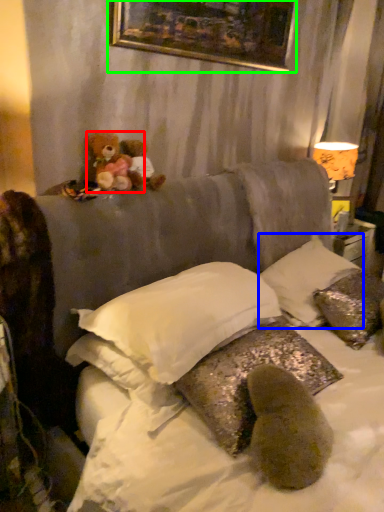
Question: Based on their relative distances, which object is farther from teddy bear (highlighted by a red box)? Choose from pillow (highlighted by a blue box) and picture frame (highlighted by a green box).

Choices:
 (A) pillow
 (B) picture frame

Answer: (A)